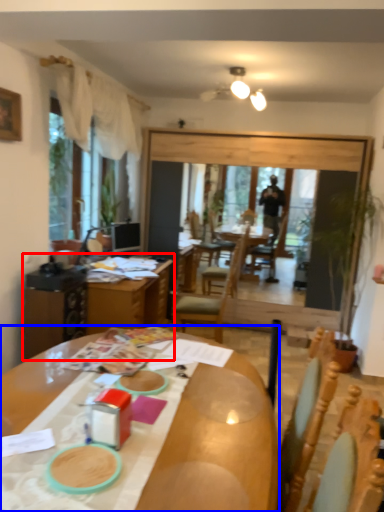
Question: Which of the following is the farthest to the observer, table (highlighted by a red box) or desk (highlighted by a blue box)?

Choices:
 (A) table
 (B) desk

Answer: (A)